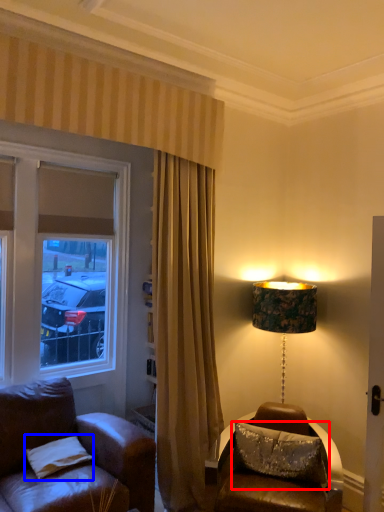
Question: Which point is closer to the camera, pillow (highlighted by a red box) or pillow (highlighted by a blue box)?

Choices:
 (A) pillow
 (B) pillow

Answer: (B)